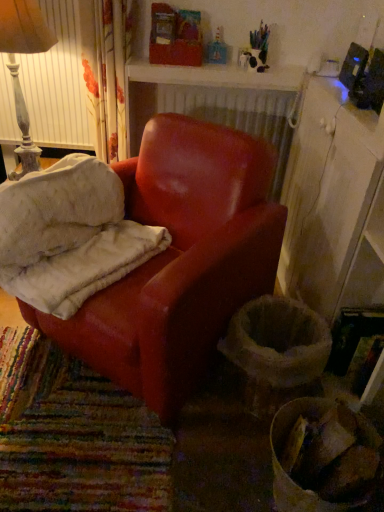
Question: Is leather armchair at center positioned beyond the bounds of distressed white lampshade at upper left?

Choices:
 (A) yes
 (B) no

Answer: (A)

Question: From a real-world perspective, is leather armchair at center on distressed white lampshade at upper left?

Choices:
 (A) no
 (B) yes

Answer: (A)

Question: Is leather armchair at center smaller than distressed white lampshade at upper left?

Choices:
 (A) yes
 (B) no

Answer: (B)

Question: Is the depth of leather armchair at center greater than that of distressed white lampshade at upper left?

Choices:
 (A) no
 (B) yes

Answer: (A)

Question: Are leather armchair at center and distressed white lampshade at upper left far apart?

Choices:
 (A) yes
 (B) no

Answer: (B)

Question: In terms of width, does leather armchair at center look wider or thinner when compared to distressed white lampshade at upper left?

Choices:
 (A) thin
 (B) wide

Answer: (B)

Question: Is point (94, 285) positioned closer to the camera than point (21, 105)?

Choices:
 (A) closer
 (B) farther

Answer: (A)

Question: In the image, is leather armchair at center on the left side or the right side of distressed white lampshade at upper left?

Choices:
 (A) left
 (B) right

Answer: (B)

Question: From the image's perspective, relative to distressed white lampshade at upper left, is leather armchair at center above or below?

Choices:
 (A) above
 (B) below

Answer: (B)

Question: Would you say distressed white lampshade at upper left is to the left or to the right of matte red armchair at center in the picture?

Choices:
 (A) left
 (B) right

Answer: (A)

Question: Based on their sizes in the image, would you say distressed white lampshade at upper left is bigger or smaller than matte red armchair at center?

Choices:
 (A) big
 (B) small

Answer: (B)

Question: From the image's perspective, is distressed white lampshade at upper left positioned above or below matte red armchair at center?

Choices:
 (A) below
 (B) above

Answer: (B)

Question: Do you think distressed white lampshade at upper left is within matte red armchair at center, or outside of it?

Choices:
 (A) inside
 (B) outside

Answer: (B)

Question: Is point (99, 161) positioned closer to the camera than point (248, 103)?

Choices:
 (A) closer
 (B) farther

Answer: (A)

Question: From a real-world perspective, is leather armchair at center positioned above or below white textured radiator at upper center?

Choices:
 (A) above
 (B) below

Answer: (B)